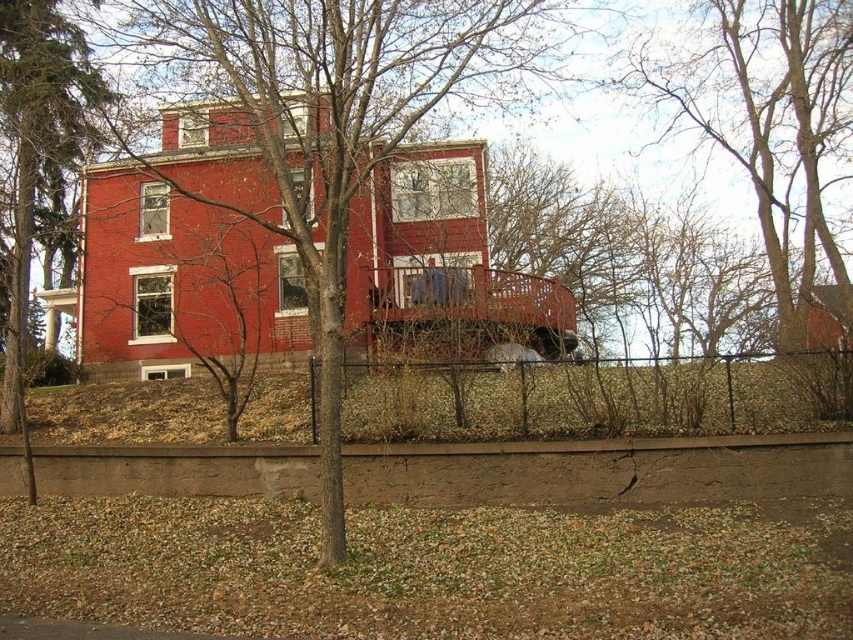
You are standing at the base of the house and notice a point marked at coordinates (x=334, y=122). What is located at that point?

The point at coordinates (x=334, y=122) marks bare branches at center.

You are standing at the base of the house and want to walk towards the bare branches at upper center. Is the black metal fence at lower center in your path?

The black metal fence at lower center is 10.54 meters away from the bare branches at upper center, so it is in your path as you walk towards them.

You are standing in the foreground of the scene, near the gravel area. You want to walk to the front door of the house but need to know if you can reach it without crossing the black metal fence at lower center. Can you reach the front door without crossing the fence?

The black metal fence at lower center is 34.36 feet away from the viewer. Since the front door is part of the house which is situated behind the landscaped area and retaining wall, you would need to walk past the fence to reach it. Therefore, you must cross the black metal fence at lower center to get to the front door.